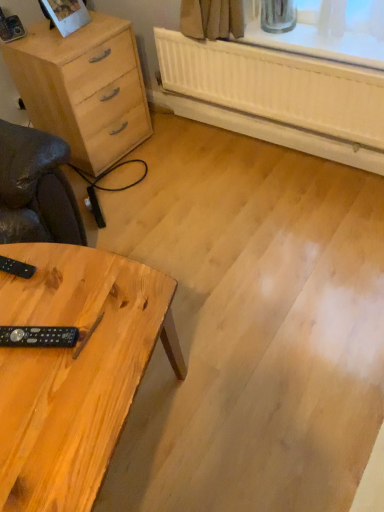
Locate an element on the screen. This screenshot has height=512, width=384. vacant space in between black plastic remote at lower left, acting as the first control starting from the front, and black plastic remote at lower left, which is the 2th control from bottom to top is located at coordinates (31, 304).